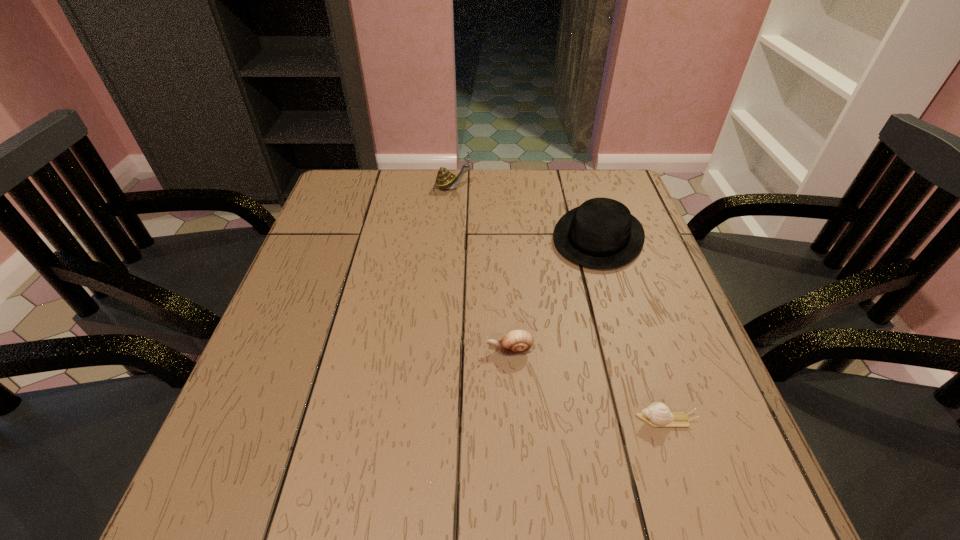
Find the location of a particular element. This screenshot has height=540, width=960. the farthest escargot is located at coordinates (445, 180).

At what (x,y) coordinates should I click in order to perform the action: click on the leftmost object. Please return your answer as a coordinate pair (x, y). The width and height of the screenshot is (960, 540). Looking at the image, I should click on (445, 180).

In order to click on fedora in this screenshot , I will do `click(601, 233)`.

Identify the location of the third nearest object. tap(601, 233).

I want to click on the second escargot from left to right, so click(x=517, y=342).

At what (x,y) coordinates should I click in order to perform the action: click on the third tallest object. Please return your answer as a coordinate pair (x, y). Looking at the image, I should click on (517, 342).

This screenshot has height=540, width=960. What are the coordinates of `the nearest object` in the screenshot? It's located at (657, 414).

At what (x,y) coordinates should I click in order to perform the action: click on the shortest object. Please return your answer as a coordinate pair (x, y). Looking at the image, I should click on (657, 414).

The image size is (960, 540). Find the location of `vacant space located 0.260m on the face of the farthest object`. vacant space located 0.260m on the face of the farthest object is located at coordinates (558, 187).

At what (x,y) coordinates should I click in order to perform the action: click on vacant space located 0.070m on the back of the fedora. Please return your answer as a coordinate pair (x, y). The height and width of the screenshot is (540, 960). Looking at the image, I should click on (585, 194).